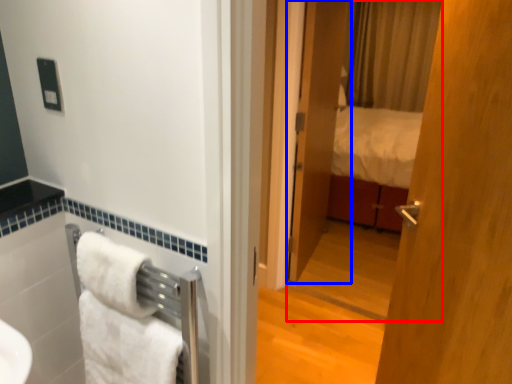
Question: Among these objects, which one is nearest to the camera, mirror (highlighted by a red box) or door (highlighted by a blue box)?

Choices:
 (A) mirror
 (B) door

Answer: (A)